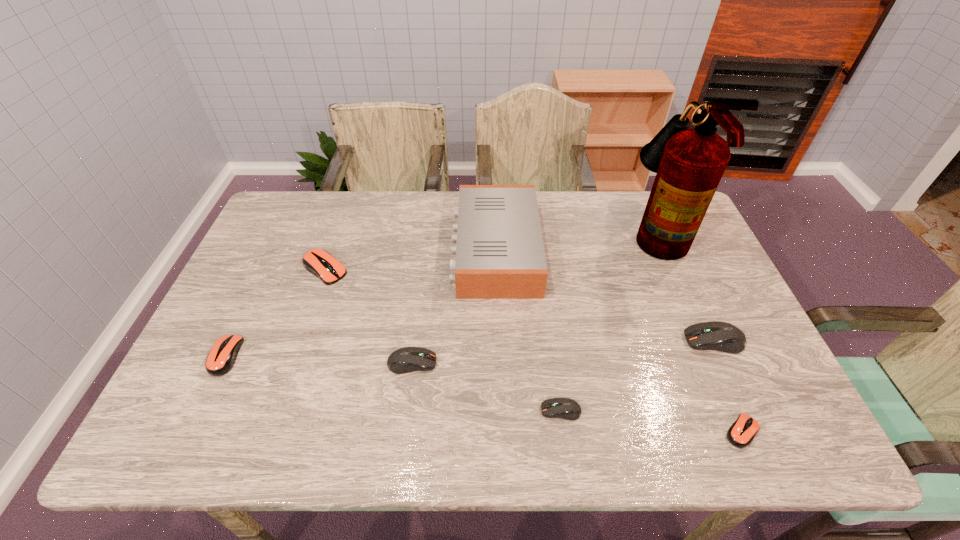
Identify which object is the closest to the second biggest dark computer equipment. Please provide its 2D coordinates. Your answer should be formatted as a tuple, i.e. [(x, y)], where the tuple contains the x and y coordinates of a point satisfying the conditions above.

[(500, 254)]

Locate an element on the screen. Image resolution: width=960 pixels, height=540 pixels. object that is the seventh nearest to the sixth shortest object is located at coordinates (221, 358).

Locate which computer mouse is the third closest to the second smallest dark computer equipment. Please provide its 2D coordinates. Your answer should be formatted as a tuple, i.e. [(x, y)], where the tuple contains the x and y coordinates of a point satisfying the conditions above.

[(221, 358)]

The image size is (960, 540). I want to click on computer mouse that is the fifth closest to the radio receiver, so click(741, 433).

Identify the location of the second closest dark computer equipment to the third object from left to right. The height and width of the screenshot is (540, 960). (720, 336).

The width and height of the screenshot is (960, 540). What are the coordinates of `the second closest dark computer equipment relative to the radio receiver` in the screenshot? It's located at (565, 408).

Select which orange computer mouse appears as the closest to the second computer mouse from left to right. Please provide its 2D coordinates. Your answer should be formatted as a tuple, i.e. [(x, y)], where the tuple contains the x and y coordinates of a point satisfying the conditions above.

[(221, 358)]

The width and height of the screenshot is (960, 540). What are the coordinates of `orange computer mouse that is the closest one to the second orange computer mouse from right to left` in the screenshot? It's located at (221, 358).